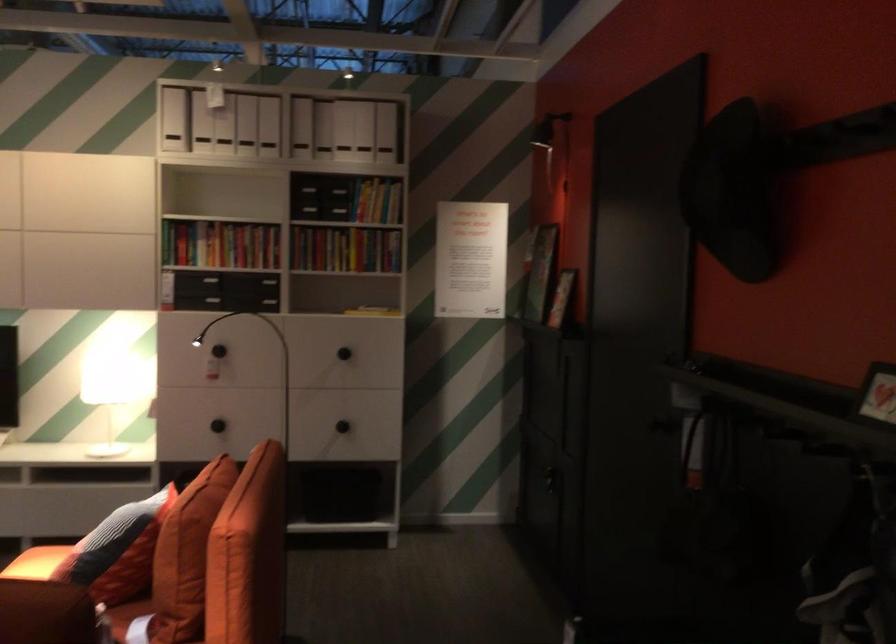
Image resolution: width=896 pixels, height=644 pixels. I want to click on black hat, so click(736, 191).